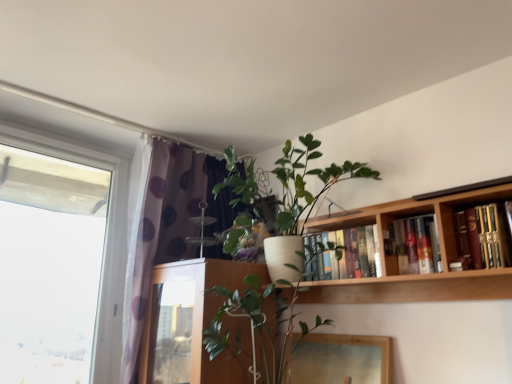
What do you see at coordinates (342, 359) in the screenshot? I see `wooden picture frame at lower center` at bounding box center [342, 359].

In order to face white matte pot at upper center, the first houseplant from the top, should I rotate leftwards or rightwards?

Turn right by 4.285 degrees to look at white matte pot at upper center, the first houseplant from the top.

What do you see at coordinates (254, 327) in the screenshot? The image size is (512, 384). I see `white ceramic pot at center, arranged as the first houseplant when ordered from the bottom` at bounding box center [254, 327].

The width and height of the screenshot is (512, 384). I want to click on hardcover books at upper right, positioned as the first book in front-to-back order, so click(x=483, y=236).

Where is `wooden picture frame at lower center`? wooden picture frame at lower center is located at coordinates (342, 359).

Considering the relative sizes of hardcover books at upper center, which appears as the third book when viewed from the right, and hardcover books at upper right, the second book viewed from the back, in the image provided, is hardcover books at upper center, which appears as the third book when viewed from the right, shorter than hardcover books at upper right, the second book viewed from the back,?

No, hardcover books at upper center, which appears as the third book when viewed from the right, is not shorter than hardcover books at upper right, the second book viewed from the back.

Between point (342, 257) and point (430, 217), which one is positioned in front?

The point (430, 217) is closer to the camera.

From the image's perspective, would you say hardcover books at upper center, acting as the 1th book starting from the left, is positioned over hardcover books at upper right, marked as the second book in a left-to-right arrangement?

No.

Which of these two, purple dotted fabric at left or hardcover books at upper center, which appears as the third book when viewed from the right, is smaller?

hardcover books at upper center, which appears as the third book when viewed from the right, is smaller.

Is the surface of purple dotted fabric at left in direct contact with hardcover books at upper center, which appears as the 1th book when viewed from the back?

No.

You are a GUI agent. You are given a task and a screenshot of the screen. Output one action in this format:
    pyautogui.click(x=<x>, y=<y>)
    Task: Click on the curtain on the left of hardcover books at upper center, which is the third book from front to back
    
    Given the screenshot: What is the action you would take?
    pyautogui.click(x=157, y=227)

Could you measure the distance between purple dotted fabric at left and hardcover books at upper center, which appears as the third book when viewed from the right?

35.51 inches.

Do you think wooden picture frame at lower center is within purple dotted fabric at left, or outside of it?

wooden picture frame at lower center is spatially situated outside purple dotted fabric at left.

Considering the sizes of wooden picture frame at lower center and purple dotted fabric at left in the image, is wooden picture frame at lower center taller or shorter than purple dotted fabric at left?

wooden picture frame at lower center is shorter than purple dotted fabric at left.

From the image's perspective, is wooden picture frame at lower center located beneath purple dotted fabric at left?

Yes, from the image's perspective, wooden picture frame at lower center is below purple dotted fabric at left.

Is transparent glass window at left positioned before hardcover books at upper center, which appears as the third book when viewed from the right?

Yes.

This screenshot has width=512, height=384. I want to click on window below the hardcover books at upper center, which appears as the 1th book when viewed from the back (from the image's perspective), so click(x=105, y=241).

Is transparent glass window at left not close to hardcover books at upper center, which appears as the 1th book when viewed from the back?

Yes, transparent glass window at left and hardcover books at upper center, which appears as the 1th book when viewed from the back, are located far from each other.

From the image's perspective, is transparent glass window at left located above or below hardcover books at upper center, which appears as the 1th book when viewed from the back?

Based on their image positions, transparent glass window at left is located beneath hardcover books at upper center, which appears as the 1th book when viewed from the back.

Is white ceramic pot at center, arranged as the first houseplant when ordered from the bottom, oriented towards purple dotted fabric at left?

No, white ceramic pot at center, arranged as the first houseplant when ordered from the bottom, is not facing towards purple dotted fabric at left.

Between point (258, 310) and point (192, 194), which one is positioned in front?

Point (258, 310)

This screenshot has width=512, height=384. In order to click on curtain above the white ceramic pot at center, which is the 2th houseplant in top-to-bottom order (from a real-world perspective) in this screenshot , I will do `click(157, 227)`.

Which of these two, white ceramic pot at center, arranged as the first houseplant when ordered from the bottom, or purple dotted fabric at left, stands shorter?

Standing shorter between the two is white ceramic pot at center, arranged as the first houseplant when ordered from the bottom.

At what (x,y) coordinates should I click in order to perform the action: click on houseplant that is the 1st one when counting backward from the wooden bookshelf at upper right. Please return your answer as a coordinate pair (x, y). Looking at the image, I should click on (254, 327).

Considering the sizes of white ceramic pot at center, which is the 2th houseplant in top-to-bottom order, and wooden bookshelf at upper right in the image, is white ceramic pot at center, which is the 2th houseplant in top-to-bottom order, taller or shorter than wooden bookshelf at upper right?

Clearly, white ceramic pot at center, which is the 2th houseplant in top-to-bottom order, is taller compared to wooden bookshelf at upper right.

Consider the image. From a real-world perspective, relative to wooden bookshelf at upper right, is white ceramic pot at center, arranged as the first houseplant when ordered from the bottom, vertically above or below?

white ceramic pot at center, arranged as the first houseplant when ordered from the bottom, is below wooden bookshelf at upper right.

Looking at this image, does white ceramic pot at center, arranged as the first houseplant when ordered from the bottom, have a larger size compared to wooden bookshelf at upper right?

Yes, white ceramic pot at center, arranged as the first houseplant when ordered from the bottom, is bigger than wooden bookshelf at upper right.

Are wooden picture frame at lower center and hardcover books at upper right, the 2th book viewed from the right, beside each other?

No, wooden picture frame at lower center is not making contact with hardcover books at upper right, the 2th book viewed from the right.

Who is shorter, wooden picture frame at lower center or hardcover books at upper right, marked as the second book in a left-to-right arrangement?

hardcover books at upper right, marked as the second book in a left-to-right arrangement.

Which of these two, wooden picture frame at lower center or hardcover books at upper right, positioned as the 2th book in front-to-back order, is smaller?

hardcover books at upper right, positioned as the 2th book in front-to-back order, is smaller.

Which of these two, wooden picture frame at lower center or hardcover books at upper right, the 2th book viewed from the right, is wider?

With larger width is hardcover books at upper right, the 2th book viewed from the right.

Where is `book above the hardcover books at upper right, the second book viewed from the back (from a real-world perspective)`? The image size is (512, 384). book above the hardcover books at upper right, the second book viewed from the back (from a real-world perspective) is located at coordinates (346, 254).

Identify the location of curtain lying below the hardcover books at upper center, which appears as the 1th book when viewed from the back (from the image's perspective). Image resolution: width=512 pixels, height=384 pixels. (157, 227).

Looking at the image, which one is located closer to white ceramic pot at center, arranged as the first houseplant when ordered from the bottom, white matte pot at upper center, the first houseplant from the top, or hardcover books at upper center, which appears as the 1th book when viewed from the back?

hardcover books at upper center, which appears as the 1th book when viewed from the back, lies closer to white ceramic pot at center, arranged as the first houseplant when ordered from the bottom, than the other object.

Looking at the image, which one is located further to wooden bookshelf at upper right, white matte pot at upper center, the first houseplant from the top, or hardcover books at upper center, which appears as the third book when viewed from the right?

The object further to wooden bookshelf at upper right is white matte pot at upper center, the first houseplant from the top.

From the image, which object appears to be nearer to wooden bookshelf at upper right, hardcover books at upper right, marked as the second book in a left-to-right arrangement, or hardcover books at upper right, the 3th book when ordered from back to front?

Based on the image, hardcover books at upper right, marked as the second book in a left-to-right arrangement, appears to be nearer to wooden bookshelf at upper right.

From the image, which object appears to be farther from hardcover books at upper right, which is the 1th book from right to left, wooden picture frame at lower center or wooden bookshelf at upper right?

wooden picture frame at lower center.

When comparing their distances from hardcover books at upper right, marked as the second book in a left-to-right arrangement, does purple dotted fabric at left or hardcover books at upper right, placed as the 3th book when sorted from left to right, seem closer?

hardcover books at upper right, placed as the 3th book when sorted from left to right, is positioned closer to the anchor hardcover books at upper right, marked as the second book in a left-to-right arrangement.

Based on their spatial positions, is transparent glass window at left or hardcover books at upper center, which appears as the 1th book when viewed from the back, closer to white matte pot at upper center, the first houseplant from the top?

Based on the image, hardcover books at upper center, which appears as the 1th book when viewed from the back, appears to be nearer to white matte pot at upper center, the first houseplant from the top.

Estimate the real-world distances between objects in this image. Which object is further from hardcover books at upper center, which is the third book from front to back, hardcover books at upper right, placed as the 3th book when sorted from left to right, or transparent glass window at left?

Among the two, transparent glass window at left is located further to hardcover books at upper center, which is the third book from front to back.

Based on their spatial positions, is wooden picture frame at lower center or transparent glass window at left further from wooden bookshelf at upper right?

transparent glass window at left is positioned further to the anchor wooden bookshelf at upper right.

Find the location of a particular element. This screenshot has width=512, height=384. bookcase situated between purple dotted fabric at left and hardcover books at upper right, positioned as the first book in front-to-back order, from left to right is located at coordinates [396, 257].

Find the location of a particular element. The height and width of the screenshot is (384, 512). bookcase between white matte pot at upper center, the first houseplant from the top, and wooden picture frame at lower center, in the vertical direction is located at coordinates (396, 257).

Where is `picture frame between transparent glass window at left and hardcover books at upper right, the second book viewed from the back, in the horizontal direction`? The width and height of the screenshot is (512, 384). picture frame between transparent glass window at left and hardcover books at upper right, the second book viewed from the back, in the horizontal direction is located at coordinates (342, 359).

Locate an element on the screen. This screenshot has width=512, height=384. curtain between transparent glass window at left and hardcover books at upper right, marked as the second book in a left-to-right arrangement, from left to right is located at coordinates click(x=157, y=227).